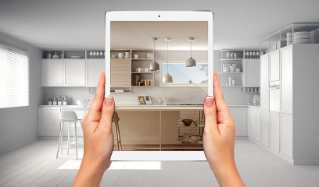
This screenshot has width=319, height=187. What are the coordinates of `blinds` in the screenshot? It's located at (11, 78).